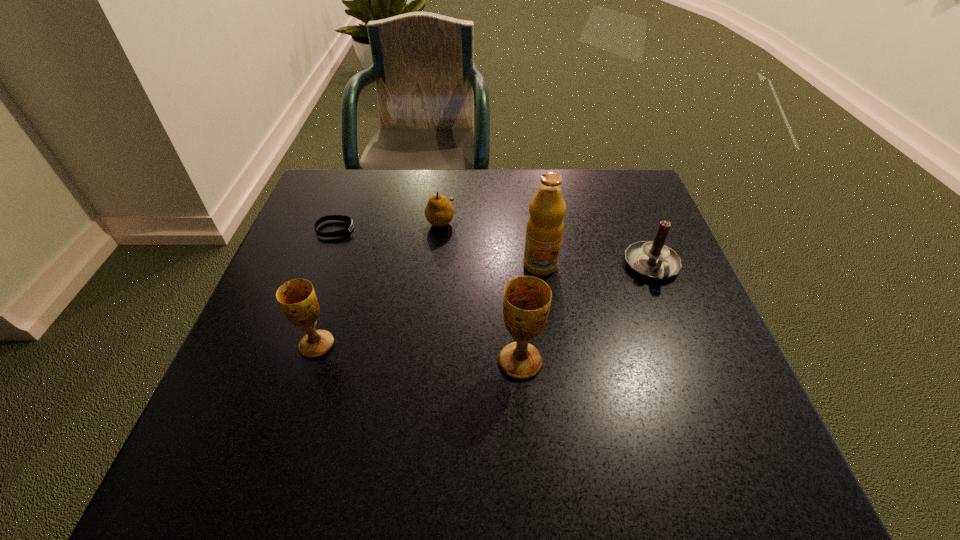
Image resolution: width=960 pixels, height=540 pixels. I want to click on object present at the right edge, so click(x=652, y=259).

In the image, there is a desktop. Where is `free space at the far edge`? Image resolution: width=960 pixels, height=540 pixels. free space at the far edge is located at coordinates (456, 194).

Identify the location of vacant region at the near edge of the desktop. (650, 419).

The image size is (960, 540). What are the coordinates of `free region at the left edge of the desktop` in the screenshot? It's located at (260, 366).

Identify the location of free space at the right edge of the desktop. Image resolution: width=960 pixels, height=540 pixels. (651, 239).

Locate an element on the screen. free location at the near left corner is located at coordinates (258, 417).

Locate an element on the screen. free space at the far right corner of the desktop is located at coordinates (618, 215).

Locate an element on the screen. The height and width of the screenshot is (540, 960). vacant area that lies between the tallest object and the fourth shortest object is located at coordinates (428, 305).

You are a GUI agent. You are given a task and a screenshot of the screen. Output one action in this format:
    pyautogui.click(x=<x>, y=<y>)
    Task: Click on the free space that is in between the fourth shortest object and the fifth tallest object
    
    Given the screenshot: What is the action you would take?
    (379, 282)

Where is `free area in between the right chalice and the fourth shortest object`? The image size is (960, 540). free area in between the right chalice and the fourth shortest object is located at coordinates (419, 353).